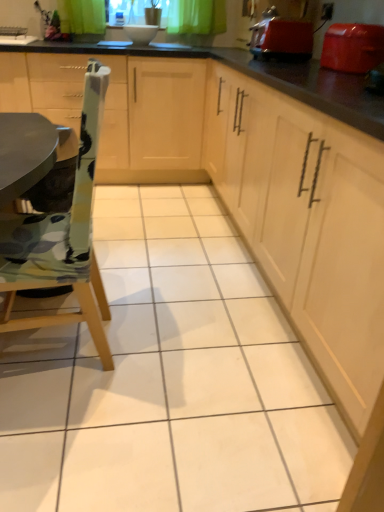
Describe the element at coordinates (152, 123) in the screenshot. I see `matte wood cabinets at center, the second cabinetry in the right-to-left sequence` at that location.

This screenshot has height=512, width=384. What do you see at coordinates (281, 38) in the screenshot? I see `matte red toaster at upper right, the first appliance positioned from the left` at bounding box center [281, 38].

The height and width of the screenshot is (512, 384). Find the location of `wooden chair at left`. wooden chair at left is located at coordinates (x=62, y=236).

Is point (21, 222) positioned after point (311, 42)?

No.

Would you say wooden chair at left is a long distance from matte red toaster at upper right, the first appliance in the back-to-front sequence?

Absolutely, wooden chair at left is distant from matte red toaster at upper right, the first appliance in the back-to-front sequence.

Based on the photo, between wooden chair at left and matte red toaster at upper right, the first appliance positioned from the left, which one appears on the right side from the viewer's perspective?

Positioned to the right is matte red toaster at upper right, the first appliance positioned from the left.

There is a wooden chair at left. Where is `the 2nd appliance above it (from a real-world perspective)`? The width and height of the screenshot is (384, 512). the 2nd appliance above it (from a real-world perspective) is located at coordinates (281, 38).

Which object is further away from the camera taking this photo, matte red toaster at upper right, the first appliance in the back-to-front sequence, or light wood cabinet at center, arranged as the first cabinetry when viewed from the right?

matte red toaster at upper right, the first appliance in the back-to-front sequence, is behind.

From a real-world perspective, between matte red toaster at upper right, the first appliance in the back-to-front sequence, and light wood cabinet at center, arranged as the first cabinetry when viewed from the right, who is vertically higher?

From a 3D spatial view, matte red toaster at upper right, the first appliance in the back-to-front sequence, is above.

In the scene shown: Between matte red toaster at upper right, the first appliance in the back-to-front sequence, and light wood cabinet at center, arranged as the first cabinetry when viewed from the right, which one has less height?

matte red toaster at upper right, the first appliance in the back-to-front sequence.

Locate an element on the screen. The image size is (384, 512). cabinetry that is in front of the matte red toaster at upper right, the first appliance positioned from the left is located at coordinates (307, 224).

Is matte red toaster at upper right, the first appliance in the back-to-front sequence, taller than matte wood cabinets at center, which is the 1th cabinetry in left-to-right order?

No.

Is matte red toaster at upper right, the second appliance when ordered from right to left, positioned beyond the bounds of matte wood cabinets at center, the second cabinetry in the right-to-left sequence?

Indeed, matte red toaster at upper right, the second appliance when ordered from right to left, is completely outside matte wood cabinets at center, the second cabinetry in the right-to-left sequence.

From a real-world perspective, relative to matte wood cabinets at center, the second cabinetry in the right-to-left sequence, is matte red toaster at upper right, the second appliance when ordered from right to left, vertically above or below?

In terms of real-world spatial position, matte red toaster at upper right, the second appliance when ordered from right to left, is above matte wood cabinets at center, the second cabinetry in the right-to-left sequence.

Identify the location of the 2nd appliance above the matte wood cabinets at center, which is the 1th cabinetry in left-to-right order (from a real-world perspective). (281, 38).

Is wooden chair at left spatially inside matte wood cabinets at center, which is the 1th cabinetry in left-to-right order, or outside of it?

wooden chair at left is spatially situated outside matte wood cabinets at center, which is the 1th cabinetry in left-to-right order.

Looking at their sizes, would you say wooden chair at left is wider or thinner than matte wood cabinets at center, which is the 1th cabinetry in left-to-right order?

In the image, wooden chair at left appears to be more narrow than matte wood cabinets at center, which is the 1th cabinetry in left-to-right order.

Is wooden chair at left directly adjacent to matte wood cabinets at center, which is the 1th cabinetry in left-to-right order?

There is a gap between wooden chair at left and matte wood cabinets at center, which is the 1th cabinetry in left-to-right order.

Looking at this image, is wooden chair at left to the left or to the right of matte wood cabinets at center, which is the 1th cabinetry in left-to-right order, in the image?

wooden chair at left is to the right of matte wood cabinets at center, which is the 1th cabinetry in left-to-right order.

From the image's perspective, which one is positioned higher, shiny plastic toaster at upper right, the 2th appliance in the left-to-right sequence, or light wood cabinet at center, placed as the 2th cabinetry when sorted from left to right?

shiny plastic toaster at upper right, the 2th appliance in the left-to-right sequence, from the image's perspective.

Considering the sizes of objects shiny plastic toaster at upper right, the 2th appliance in the left-to-right sequence, and light wood cabinet at center, placed as the 2th cabinetry when sorted from left to right, in the image provided, who is shorter, shiny plastic toaster at upper right, the 2th appliance in the left-to-right sequence, or light wood cabinet at center, placed as the 2th cabinetry when sorted from left to right,?

shiny plastic toaster at upper right, the 2th appliance in the left-to-right sequence, is shorter.

What are the coordinates of `cabinetry in front of the shiny plastic toaster at upper right, which ranks as the 2th appliance in back-to-front order` in the screenshot? It's located at (307, 224).

Is shiny plastic toaster at upper right, the 2th appliance in the left-to-right sequence, completely or partially outside of light wood cabinet at center, arranged as the first cabinetry when viewed from the right?

shiny plastic toaster at upper right, the 2th appliance in the left-to-right sequence, is positioned outside light wood cabinet at center, arranged as the first cabinetry when viewed from the right.

Is shiny plastic toaster at upper right, which appears as the first appliance when viewed from the front, to the left of wooden chair at left from the viewer's perspective?

No.

Is shiny plastic toaster at upper right, the first appliance in the right-to-left sequence, taller or shorter than wooden chair at left?

shiny plastic toaster at upper right, the first appliance in the right-to-left sequence, is shorter than wooden chair at left.

Based on the photo, from a real-world perspective, is shiny plastic toaster at upper right, which appears as the first appliance when viewed from the front, physically below wooden chair at left?

No, from a real-world perspective, shiny plastic toaster at upper right, which appears as the first appliance when viewed from the front, is not beneath wooden chair at left.

Locate an element on the screen. the 2nd appliance above the light wood cabinet at center, placed as the 2th cabinetry when sorted from left to right (from a real-world perspective) is located at coordinates point(281,38).

Is light wood cabinet at center, placed as the 2th cabinetry when sorted from left to right, inside the boundaries of matte red toaster at upper right, the first appliance in the back-to-front sequence, or outside?

light wood cabinet at center, placed as the 2th cabinetry when sorted from left to right, lies outside matte red toaster at upper right, the first appliance in the back-to-front sequence.

From the image's perspective, which object appears higher, light wood cabinet at center, placed as the 2th cabinetry when sorted from left to right, or matte red toaster at upper right, the second appliance when ordered from right to left?

matte red toaster at upper right, the second appliance when ordered from right to left.

From a real-world perspective, between light wood cabinet at center, arranged as the first cabinetry when viewed from the right, and matte red toaster at upper right, the first appliance positioned from the left, who is vertically lower?

In real-world perspective, light wood cabinet at center, arranged as the first cabinetry when viewed from the right, is lower.

The width and height of the screenshot is (384, 512). I want to click on chair that is on the left side of matte red toaster at upper right, which is the 2th appliance in front-to-back order, so click(x=62, y=236).

Find the location of a particular element. The width and height of the screenshot is (384, 512). the 2nd appliance above when counting from the light wood cabinet at center, placed as the 2th cabinetry when sorted from left to right (from the image's perspective) is located at coordinates (x=281, y=38).

Which object lies nearer to the anchor point matte red toaster at upper right, the second appliance when ordered from right to left, wooden chair at left or matte wood cabinets at center, which is the 1th cabinetry in left-to-right order?

matte wood cabinets at center, which is the 1th cabinetry in left-to-right order, lies closer to matte red toaster at upper right, the second appliance when ordered from right to left, than the other object.

When comparing their distances from matte wood cabinets at center, which is the 1th cabinetry in left-to-right order, does light wood cabinet at center, placed as the 2th cabinetry when sorted from left to right, or wooden chair at left seem further?

The object further to matte wood cabinets at center, which is the 1th cabinetry in left-to-right order, is wooden chair at left.

Which object lies nearer to the anchor point matte wood cabinets at center, which is the 1th cabinetry in left-to-right order, light wood cabinet at center, placed as the 2th cabinetry when sorted from left to right, or shiny plastic toaster at upper right, which ranks as the 2th appliance in back-to-front order?

light wood cabinet at center, placed as the 2th cabinetry when sorted from left to right, is positioned closer to the anchor matte wood cabinets at center, which is the 1th cabinetry in left-to-right order.

Looking at the image, which one is located closer to matte red toaster at upper right, the first appliance positioned from the left, shiny plastic toaster at upper right, which appears as the first appliance when viewed from the front, or light wood cabinet at center, placed as the 2th cabinetry when sorted from left to right?

Among the two, shiny plastic toaster at upper right, which appears as the first appliance when viewed from the front, is located nearer to matte red toaster at upper right, the first appliance positioned from the left.

When comparing their distances from light wood cabinet at center, placed as the 2th cabinetry when sorted from left to right, does matte red toaster at upper right, the second appliance when ordered from right to left, or wooden chair at left seem closer?

The object closer to light wood cabinet at center, placed as the 2th cabinetry when sorted from left to right, is wooden chair at left.

Which object lies nearer to the anchor point matte wood cabinets at center, which is the 1th cabinetry in left-to-right order, matte red toaster at upper right, the first appliance positioned from the left, or wooden chair at left?

matte red toaster at upper right, the first appliance positioned from the left, is positioned closer to the anchor matte wood cabinets at center, which is the 1th cabinetry in left-to-right order.

Looking at the image, which one is located closer to shiny plastic toaster at upper right, the first appliance in the right-to-left sequence, matte wood cabinets at center, the second cabinetry in the right-to-left sequence, or light wood cabinet at center, arranged as the first cabinetry when viewed from the right?

Among the two, light wood cabinet at center, arranged as the first cabinetry when viewed from the right, is located nearer to shiny plastic toaster at upper right, the first appliance in the right-to-left sequence.

When comparing their distances from matte red toaster at upper right, the second appliance when ordered from right to left, does wooden chair at left or shiny plastic toaster at upper right, the 2th appliance in the left-to-right sequence, seem closer?

shiny plastic toaster at upper right, the 2th appliance in the left-to-right sequence, is closer to matte red toaster at upper right, the second appliance when ordered from right to left.

This screenshot has height=512, width=384. I want to click on cabinetry between wooden chair at left and shiny plastic toaster at upper right, which ranks as the 2th appliance in back-to-front order, from left to right, so click(307, 224).

Locate an element on the screen. The image size is (384, 512). appliance between light wood cabinet at center, placed as the 2th cabinetry when sorted from left to right, and matte red toaster at upper right, the first appliance positioned from the left, from front to back is located at coordinates (353, 47).

Find the location of a particular element. The image size is (384, 512). appliance between matte wood cabinets at center, which is the 1th cabinetry in left-to-right order, and shiny plastic toaster at upper right, the first appliance in the right-to-left sequence is located at coordinates (281, 38).

At what (x,y) coordinates should I click in order to perform the action: click on chair between light wood cabinet at center, arranged as the first cabinetry when viewed from the right, and matte red toaster at upper right, the first appliance in the back-to-front sequence, from front to back. Please return your answer as a coordinate pair (x, y). The image size is (384, 512). Looking at the image, I should click on (62, 236).